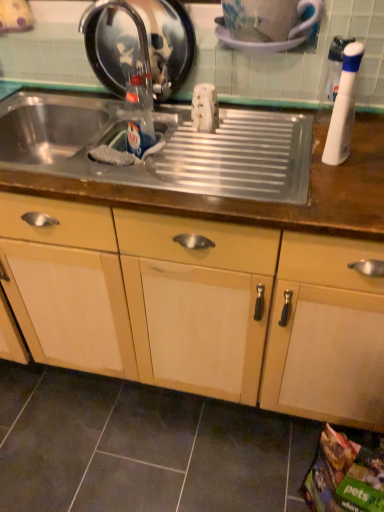
Where is `free space that is in between satin nickel faucet at upper left and white plastic bottle at right, the 1th bottle positioned from the right`? Image resolution: width=384 pixels, height=512 pixels. free space that is in between satin nickel faucet at upper left and white plastic bottle at right, the 1th bottle positioned from the right is located at coordinates (227, 134).